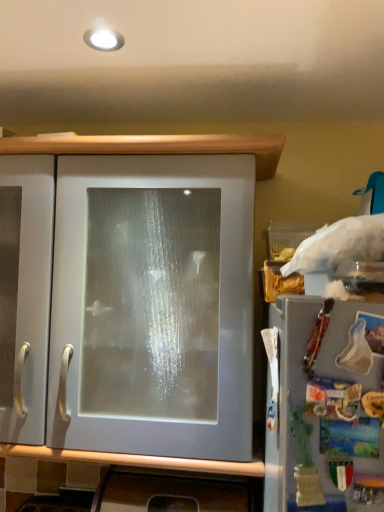
This screenshot has height=512, width=384. What do you see at coordinates (157, 147) in the screenshot? I see `satin white cabinet at center` at bounding box center [157, 147].

Image resolution: width=384 pixels, height=512 pixels. I want to click on satin white cabinet at center, so click(157, 147).

I want to click on satin white cabinet at center, so click(157, 147).